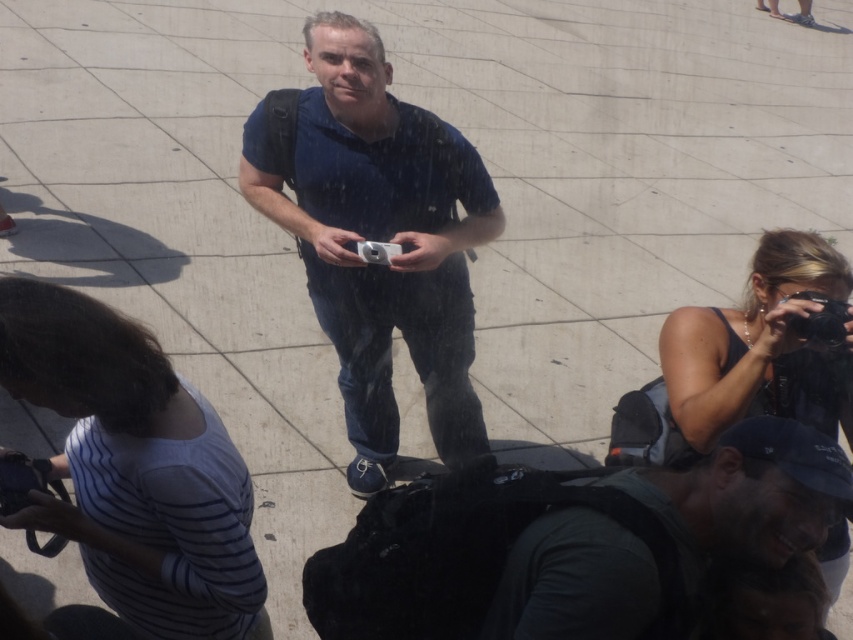
Question: Does white striped shirt at lower left appear over matte black camera at lower right?

Choices:
 (A) yes
 (B) no

Answer: (B)

Question: From the image, what is the correct spatial relationship of white striped shirt at lower left in relation to matte black camera at lower right?

Choices:
 (A) below
 (B) above

Answer: (A)

Question: Which object is closer to the camera taking this photo?

Choices:
 (A) black rubber camera at upper right
 (B) white striped shirt at lower left
 (C) matte black camera at lower right
 (D) dark green fabric backpack at lower center

Answer: (D)

Question: Which point appears farthest from the camera in this image?

Choices:
 (A) pos(795,397)
 (B) pos(381,243)
 (C) pos(253,563)
 (D) pos(352,77)

Answer: (B)

Question: Can you confirm if dark green fabric backpack at lower center is positioned above black rubber camera at upper right?

Choices:
 (A) no
 (B) yes

Answer: (A)

Question: Among these objects, which one is farthest from the camera?

Choices:
 (A) white striped shirt at lower left
 (B) matte black camera at lower right
 (C) silver metallic camera at center
 (D) black rubber camera at upper right

Answer: (C)